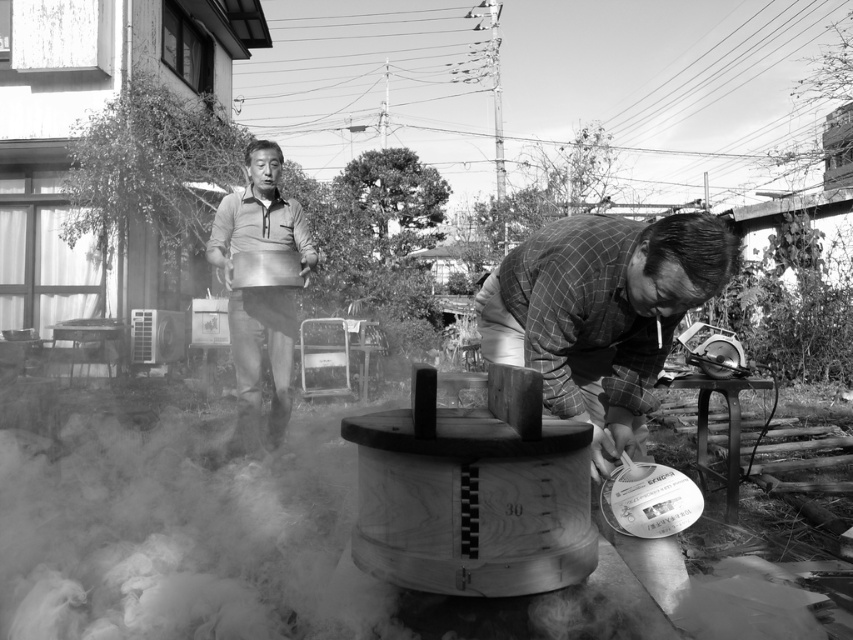
Which is above, wooden plaid shirt at lower right or matte gray shirt at upper center?

matte gray shirt at upper center is above.

Is wooden plaid shirt at lower right closer to camera compared to matte gray shirt at upper center?

Yes, wooden plaid shirt at lower right is closer to the viewer.

You are a GUI agent. You are given a task and a screenshot of the screen. Output one action in this format:
    pyautogui.click(x=<x>, y=<y>)
    Task: Click on the wooden plaid shirt at lower right
    The height and width of the screenshot is (640, 853).
    Given the screenshot: What is the action you would take?
    pyautogui.click(x=601, y=312)